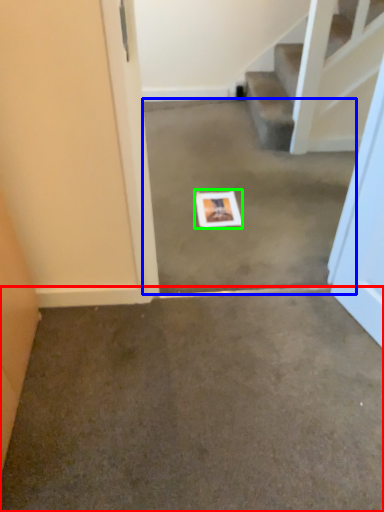
Question: Considering the real-world distances, which object is closest to concrete (highlighted by a red box)? concrete (highlighted by a blue box) or postcard (highlighted by a green box).

Choices:
 (A) concrete
 (B) postcard

Answer: (A)